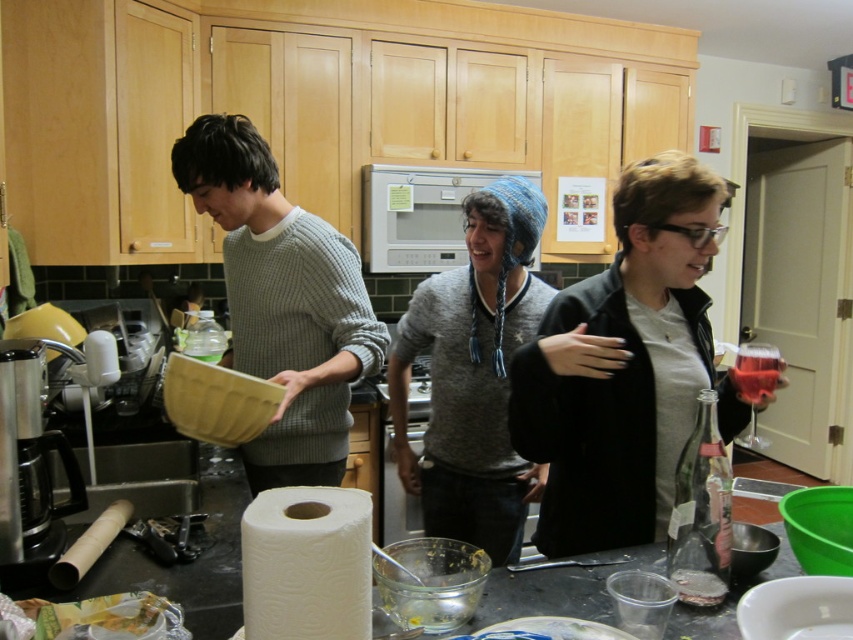
From the picture: You are a chef in the kitchen and need to retrieve the clear glass bottle at lower right. However, there is a gray knitted sweater at center blocking your path. Can you move the sweater to access the bottle?

The gray knitted sweater at center is located above the clear glass bottle at lower right, so you can simply reach under the sweater to access the bottle without moving it.

You are a chef in a busy kitchen and need to quickly grab the metallic silver blender at left and the clear glass bottle at lower right. Which one should you reach for first if you want to take the one closer to your current position at the center of the counter?

The metallic silver blender at left is closer to your current position at the center of the counter than the clear glass bottle at lower right, so you should reach for the metallic silver blender at left first.

You are a chef who needs to reach the clear glass bottle at lower right to pour some liquid into the metallic silver blender at left. Can you easily pour the liquid from the bottle into the blender without moving any other items?

The metallic silver blender at left is located above the clear glass bottle at lower right, so you can easily pour the liquid from the clear glass bottle at lower right into the metallic silver blender at left since the blender is positioned higher up.